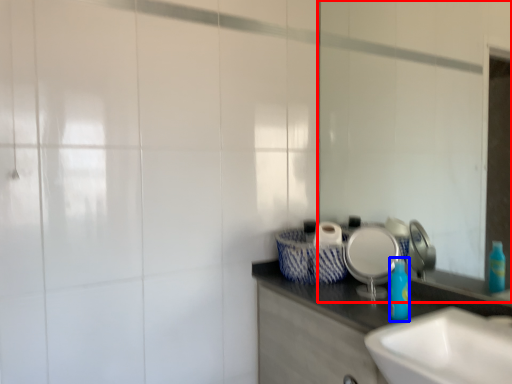
Question: Which of the following is the closest to the observer, mirror (highlighted by a red box) or bottle (highlighted by a blue box)?

Choices:
 (A) mirror
 (B) bottle

Answer: (A)